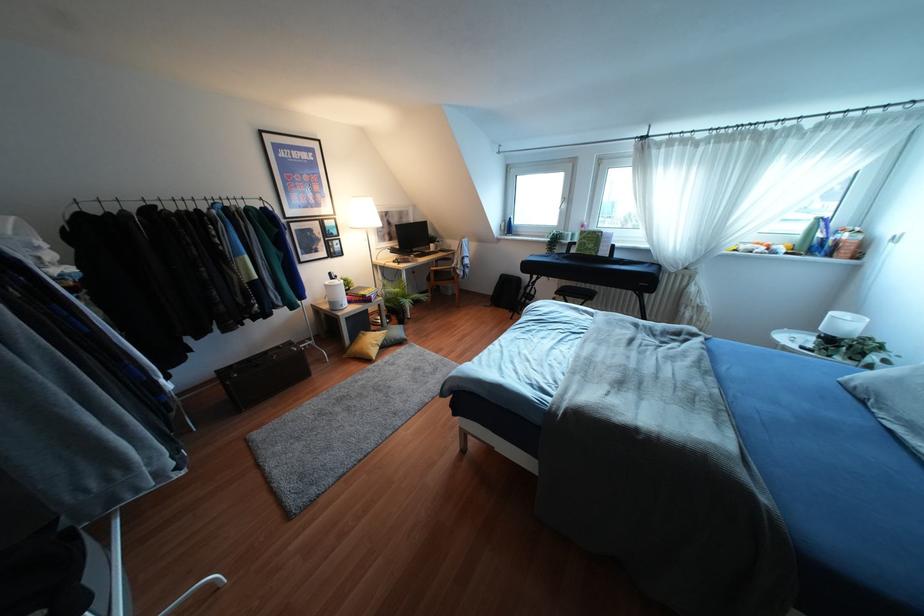
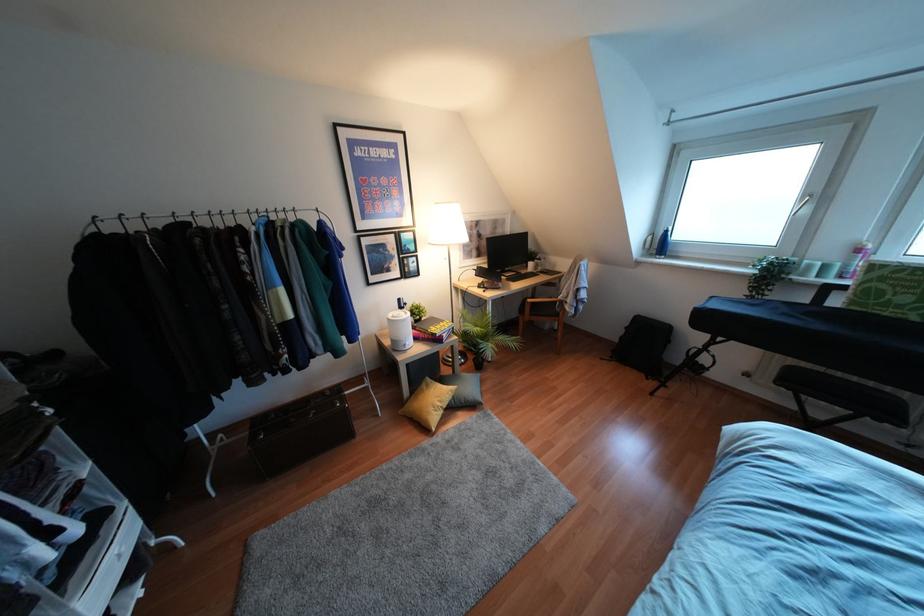
Where in the second image is the point corresponding to (393,261) from the first image?

(478, 286)